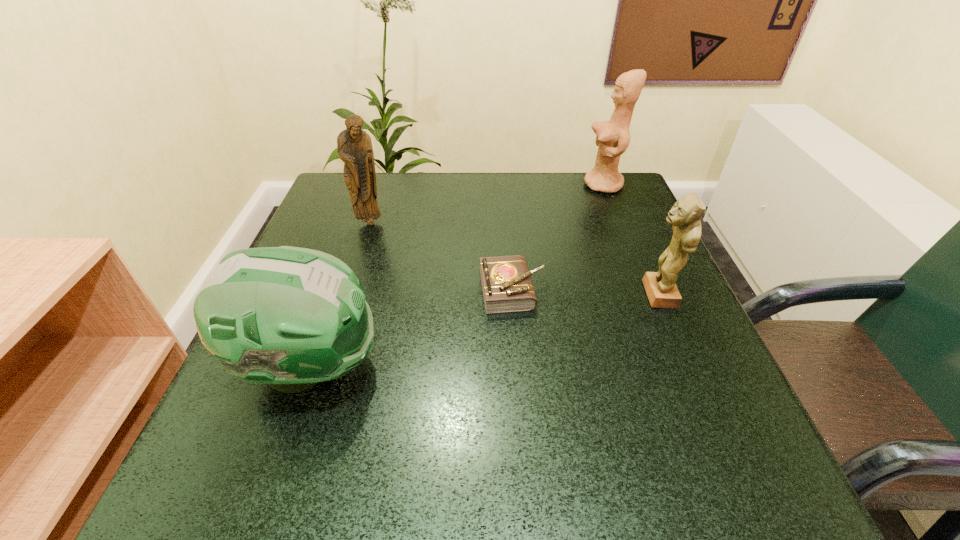
Find the location of `free space between the nearest object and the third object from left to right`. free space between the nearest object and the third object from left to right is located at coordinates (412, 328).

Find the location of a particular element. This screenshot has width=960, height=540. free spot between the farthest figurine and the shortest figurine is located at coordinates (631, 240).

At what (x,y) coordinates should I click in order to perform the action: click on unoccupied position between the farthest figurine and the nearest figurine. Please return your answer as a coordinate pair (x, y). Looking at the image, I should click on (631, 240).

Identify which object is the fourth closest to the shortest object. Please provide its 2D coordinates. Your answer should be formatted as a tuple, i.e. [(x, y)], where the tuple contains the x and y coordinates of a point satisfying the conditions above.

[(613, 137)]

Identify which object is the third closest to the shortest object. Please provide its 2D coordinates. Your answer should be formatted as a tuple, i.e. [(x, y)], where the tuple contains the x and y coordinates of a point satisfying the conditions above.

[(354, 146)]

This screenshot has width=960, height=540. Find the location of `the closest figurine to the second nearest figurine`. the closest figurine to the second nearest figurine is located at coordinates (613, 137).

Identify which figurine is the nearest to the football helmet. Please provide its 2D coordinates. Your answer should be formatted as a tuple, i.e. [(x, y)], where the tuple contains the x and y coordinates of a point satisfying the conditions above.

[(354, 146)]

At what (x,y) coordinates should I click in order to perform the action: click on vacant space that satisfies the following two spatial constraints: 1. on the front-facing side of the shortest object; 2. on the right side of the second farthest object. Please return your answer as a coordinate pair (x, y). Image resolution: width=960 pixels, height=540 pixels. Looking at the image, I should click on (348, 290).

You are a GUI agent. You are given a task and a screenshot of the screen. Output one action in this format:
    pyautogui.click(x=<x>, y=<y>)
    Task: Click on the free spot that satisfies the following two spatial constraints: 1. on the front-facing side of the farthest object; 2. on the front-facing side of the second farthest figurine
    
    Given the screenshot: What is the action you would take?
    pyautogui.click(x=618, y=222)

At what (x,y) coordinates should I click in order to perform the action: click on free space that satisfies the following two spatial constraints: 1. on the front-facing side of the second nearest figurine; 2. on the right side of the shortest object. Please return your answer as a coordinate pair (x, y). Image resolution: width=960 pixels, height=540 pixels. Looking at the image, I should click on (348, 290).